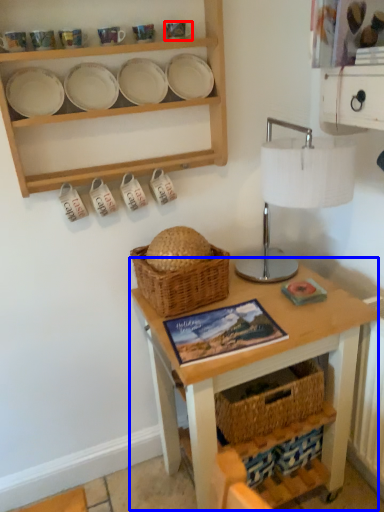
Question: Which object is further to the camera taking this photo, tableware (highlighted by a red box) or table (highlighted by a blue box)?

Choices:
 (A) tableware
 (B) table

Answer: (A)